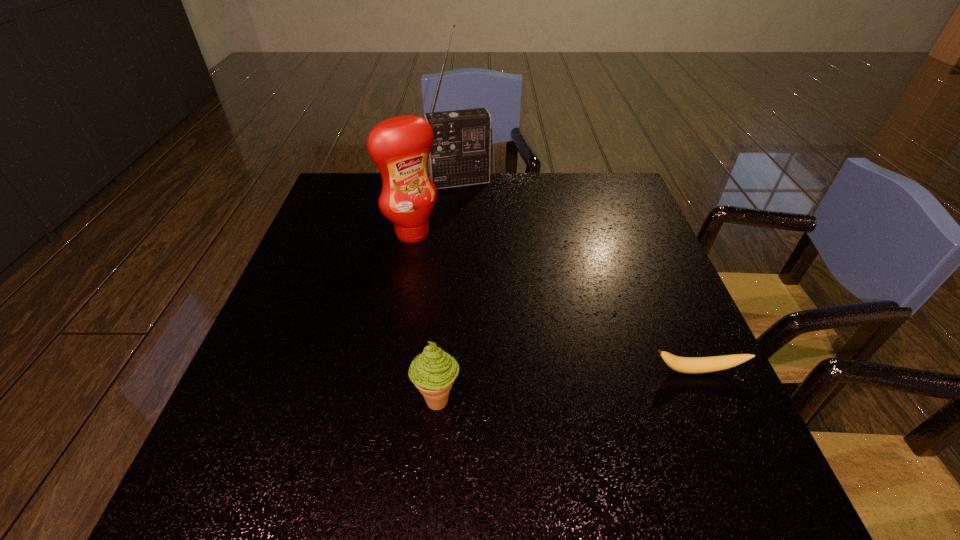
I want to click on vacant area located on the label side of the second tallest object, so click(x=501, y=333).

Find the location of a particular element. vacant space located on the label side of the second tallest object is located at coordinates (444, 265).

Where is `free spot located on the label side of the second tallest object`? This screenshot has height=540, width=960. free spot located on the label side of the second tallest object is located at coordinates (444, 265).

Locate an element on the screen. This screenshot has height=540, width=960. free space located on the display of the radio receiver is located at coordinates (481, 225).

Identify the location of free space located on the display of the radio receiver. (492, 254).

Locate an element on the screen. The width and height of the screenshot is (960, 540). vacant region located on the display of the radio receiver is located at coordinates (472, 202).

Where is `object at the far edge`? The height and width of the screenshot is (540, 960). object at the far edge is located at coordinates (462, 146).

At what (x,y) coordinates should I click in order to perform the action: click on object that is at the near edge. Please return your answer as a coordinate pair (x, y). Looking at the image, I should click on (433, 371).

Where is `object present at the right edge`? The height and width of the screenshot is (540, 960). object present at the right edge is located at coordinates (691, 365).

In the image, there is a desktop. Identify the location of vacant space at the near edge. (328, 414).